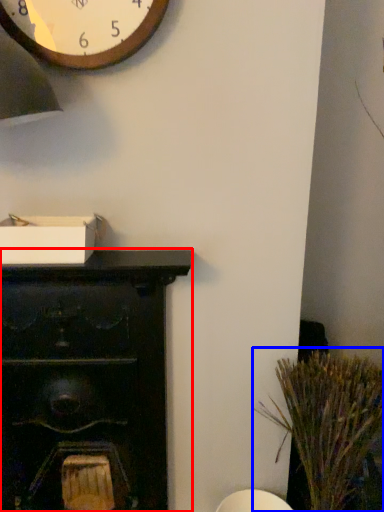
Question: Which object is further to the camera taking this photo, furniture (highlighted by a red box) or plant (highlighted by a blue box)?

Choices:
 (A) furniture
 (B) plant

Answer: (A)